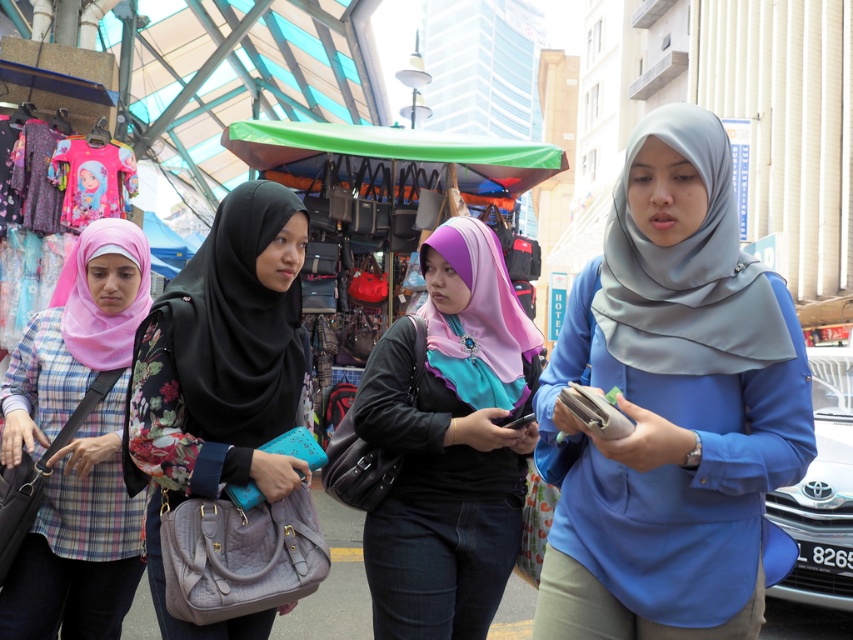
Looking at this image, you are a photographer trying to capture the purple satin hijab at center and the matte black hijab at center in the same frame. Which hijab is closer to the camera?

The purple satin hijab at center is positioned under the matte black hijab at center, so the matte black hijab at center is closer to the camera.

From the picture: You are a photographer trying to capture the group of women in the scene. You notice the matte black hijab at center and the matte pink hijab at left. Which one is positioned to the right of the other?

The matte black hijab at center is to the right of the matte pink hijab at left.